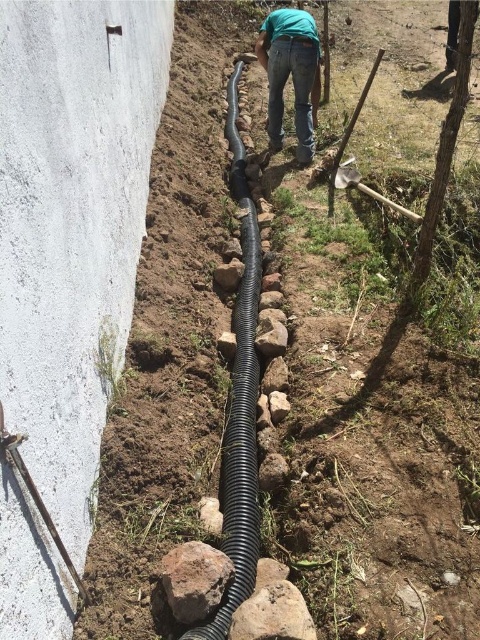
Question: Does green denim jeans at center appear under brown rough rock at center?

Choices:
 (A) no
 (B) yes

Answer: (A)

Question: Can you confirm if black corrugated pipe at center is wider than brown rough rock at center?

Choices:
 (A) yes
 (B) no

Answer: (B)

Question: Among these objects, which one is nearest to the camera?

Choices:
 (A) green denim jeans at center
 (B) black corrugated pipe at center

Answer: (B)

Question: Which of the following is the closest to the observer?

Choices:
 (A) black corrugated pipe at center
 (B) green denim jeans at center

Answer: (A)

Question: Can you confirm if black corrugated pipe at center is smaller than green denim jeans at center?

Choices:
 (A) no
 (B) yes

Answer: (A)

Question: Which object is farther from the camera taking this photo?

Choices:
 (A) black corrugated pipe at center
 (B) brown rough rock at center
 (C) green denim jeans at center

Answer: (C)